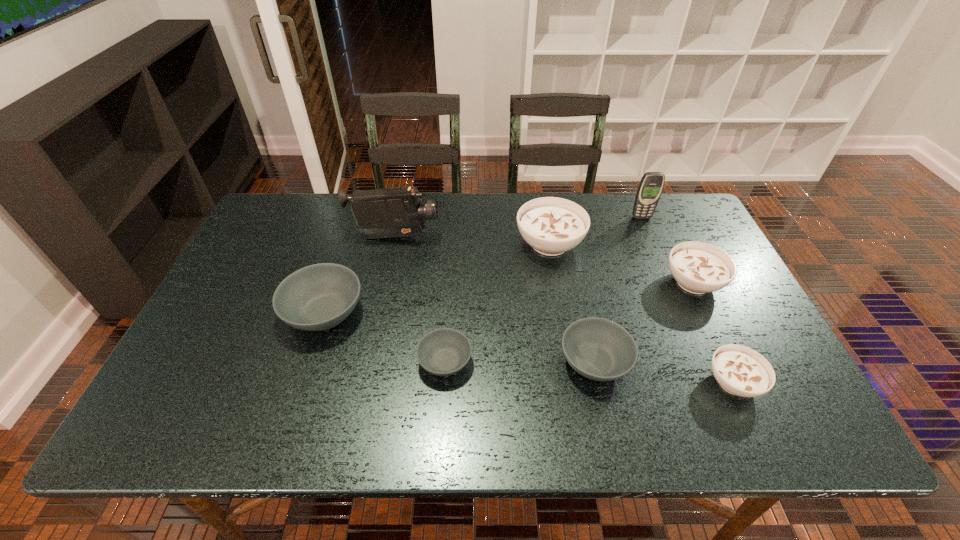
You are a GUI agent. You are given a task and a screenshot of the screen. Output one action in this format:
    pyautogui.click(x=<x>, y=<y>)
    Task: Click on the camcorder
    The width and height of the screenshot is (960, 540).
    Given the screenshot: What is the action you would take?
    pyautogui.click(x=391, y=212)

At what (x,y) coordinates should I click in order to perform the action: click on cellular telephone. Please return your answer as a coordinate pair (x, y). Looking at the image, I should click on click(x=651, y=185).

The height and width of the screenshot is (540, 960). I want to click on the farthest object, so click(x=651, y=185).

Find the location of `the sixth shortest object`. the sixth shortest object is located at coordinates (551, 225).

You are a GUI agent. You are given a task and a screenshot of the screen. Output one action in this format:
    pyautogui.click(x=<x>, y=<y>)
    Task: Click on the leftmost white soup bowl
    The height and width of the screenshot is (540, 960).
    Given the screenshot: What is the action you would take?
    pyautogui.click(x=551, y=225)

You are a GUI agent. You are given a task and a screenshot of the screen. Output one action in this format:
    pyautogui.click(x=<x>, y=<y>)
    Task: Click on the biggest gray soup bowl
    This screenshot has height=540, width=960.
    Given the screenshot: What is the action you would take?
    pyautogui.click(x=318, y=297)

Locate an element on the screen. This screenshot has width=960, height=540. the leftmost soup bowl is located at coordinates (318, 297).

I want to click on the second biggest white soup bowl, so click(x=698, y=267).

This screenshot has height=540, width=960. What are the coordinates of `the rightmost gray soup bowl` in the screenshot? It's located at (599, 349).

The width and height of the screenshot is (960, 540). I want to click on the nearest white soup bowl, so click(741, 371).